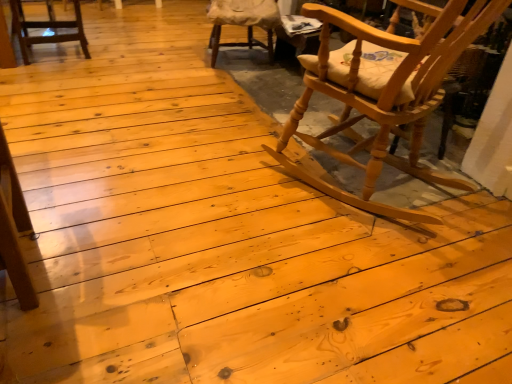
Question: From the image's perspective, would you say natural wood rocking chair at right, arranged as the 1th chair when viewed from the front, is shown under matte wood chair at upper left, which is the 2th chair in back-to-front order?

Choices:
 (A) yes
 (B) no

Answer: (A)

Question: Considering the relative sizes of natural wood rocking chair at right, acting as the 1th chair starting from the right, and matte wood chair at upper left, the 2th chair in the front-to-back sequence, in the image provided, is natural wood rocking chair at right, acting as the 1th chair starting from the right, taller than matte wood chair at upper left, the 2th chair in the front-to-back sequence,?

Choices:
 (A) no
 (B) yes

Answer: (B)

Question: From a real-world perspective, does natural wood rocking chair at right, which is the third chair from left to right, sit lower than matte wood chair at upper left, which is the 2th chair in back-to-front order?

Choices:
 (A) yes
 (B) no

Answer: (B)

Question: Considering the relative sizes of natural wood rocking chair at right, which is the third chair from left to right, and matte wood chair at upper left, marked as the 1th chair in a left-to-right arrangement, in the image provided, is natural wood rocking chair at right, which is the third chair from left to right, shorter than matte wood chair at upper left, marked as the 1th chair in a left-to-right arrangement,?

Choices:
 (A) yes
 (B) no

Answer: (B)

Question: From a real-world perspective, is natural wood rocking chair at right, acting as the 1th chair starting from the right, positioned over matte wood chair at upper left, which is the 3th chair in right-to-left order, based on gravity?

Choices:
 (A) yes
 (B) no

Answer: (A)

Question: Is matte wood chair at upper left, which is the 3th chair in right-to-left order, taller or shorter than wooden cushioned chair at upper center, placed as the first chair when sorted from back to front?

Choices:
 (A) short
 (B) tall

Answer: (A)

Question: From a real-world perspective, is matte wood chair at upper left, which is the 3th chair in right-to-left order, above or below wooden cushioned chair at upper center, arranged as the third chair when viewed from the front?

Choices:
 (A) below
 (B) above

Answer: (A)

Question: Relative to wooden cushioned chair at upper center, positioned as the second chair in right-to-left order, is matte wood chair at upper left, which is the 3th chair in right-to-left order, in front or behind?

Choices:
 (A) behind
 (B) front

Answer: (B)

Question: Based on their sizes in the image, would you say matte wood chair at upper left, which is the 2th chair in back-to-front order, is bigger or smaller than wooden cushioned chair at upper center, the 2th chair from the left?

Choices:
 (A) small
 (B) big

Answer: (A)

Question: From the image's perspective, is matte wood chair at upper left, marked as the 1th chair in a left-to-right arrangement, above or below natural wood rocking chair at right, which is the 3th chair from back to front?

Choices:
 (A) above
 (B) below

Answer: (A)

Question: Is matte wood chair at upper left, the 2th chair in the front-to-back sequence, to the left or to the right of natural wood rocking chair at right, arranged as the 1th chair when viewed from the front, in the image?

Choices:
 (A) left
 (B) right

Answer: (A)

Question: From a real-world perspective, relative to natural wood rocking chair at right, which is the 3th chair from back to front, is matte wood chair at upper left, the 2th chair in the front-to-back sequence, vertically above or below?

Choices:
 (A) below
 (B) above

Answer: (A)

Question: Is matte wood chair at upper left, which is the 2th chair in back-to-front order, wider or thinner than natural wood rocking chair at right, arranged as the 1th chair when viewed from the front?

Choices:
 (A) wide
 (B) thin

Answer: (B)

Question: In terms of width, does wooden cushioned chair at upper center, placed as the first chair when sorted from back to front, look wider or thinner when compared to natural wood rocking chair at right, acting as the 1th chair starting from the right?

Choices:
 (A) thin
 (B) wide

Answer: (A)

Question: Is point (214, 31) closer or farther from the camera than point (330, 188)?

Choices:
 (A) closer
 (B) farther

Answer: (B)